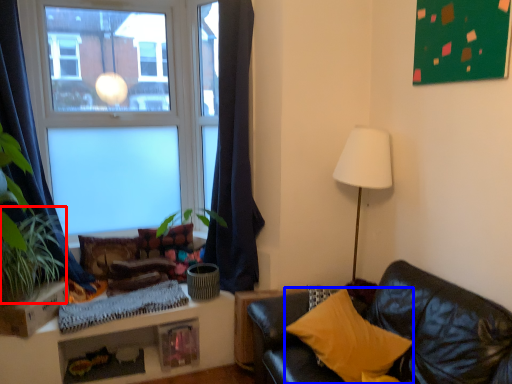
Question: Which object is further to the camera taking this photo, plant (highlighted by a red box) or pillow (highlighted by a blue box)?

Choices:
 (A) plant
 (B) pillow

Answer: (A)